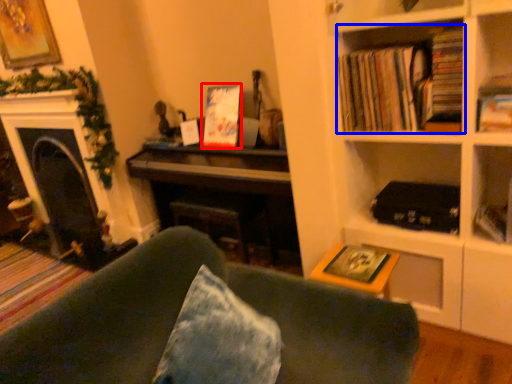
Question: Which object is closer to the camera taking this photo, paperback book (highlighted by a red box) or book (highlighted by a blue box)?

Choices:
 (A) paperback book
 (B) book

Answer: (B)